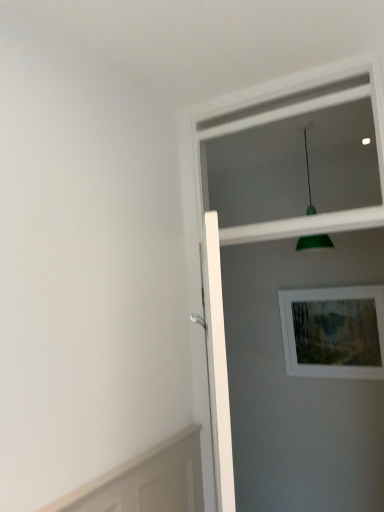
Identify the location of white glossy screen door at upper right. (291, 291).

In order to face white plastic window frame at upper center, should I rotate leftwards or rightwards?

To align with it, rotate right about 11.544°.

Image resolution: width=384 pixels, height=512 pixels. Describe the element at coordinates (314, 243) in the screenshot. I see `green matte pendant light at upper center` at that location.

Locate an element on the screen. wooden picture frame at upper right is located at coordinates (334, 332).

The height and width of the screenshot is (512, 384). Find the location of `white glossy screen door at upper right`. white glossy screen door at upper right is located at coordinates (291, 291).

Would you say white glossy screen door at upper right is inside or outside wooden picture frame at upper right?

white glossy screen door at upper right is located beyond the bounds of wooden picture frame at upper right.

From the image's perspective, would you say white glossy screen door at upper right is shown under wooden picture frame at upper right?

Yes, from the image's perspective, white glossy screen door at upper right is below wooden picture frame at upper right.

Which is closer, (x=289, y=92) or (x=334, y=298)?

Point (x=289, y=92) is closer to the camera than point (x=334, y=298).

The image size is (384, 512). What are the coordinates of `screen door located underneath the white plastic window frame at upper center (from a real-world perspective)` in the screenshot? It's located at (291, 291).

Can you confirm if white plastic window frame at upper center is thinner than white glossy screen door at upper right?

Correct, the width of white plastic window frame at upper center is less than that of white glossy screen door at upper right.

From the image's perspective, is white plastic window frame at upper center positioned above or below white glossy screen door at upper right?

Based on their image positions, white plastic window frame at upper center is located above white glossy screen door at upper right.

Based on their sizes in the image, would you say white plastic window frame at upper center is bigger or smaller than wooden picture frame at upper right?

Clearly, white plastic window frame at upper center is larger in size than wooden picture frame at upper right.

Would you say wooden picture frame at upper right is part of white plastic window frame at upper center's contents?

Definitely not — wooden picture frame at upper right is not inside white plastic window frame at upper center.

From the picture: Considering the positions of objects white plastic window frame at upper center and wooden picture frame at upper right in the image provided, who is more to the left, white plastic window frame at upper center or wooden picture frame at upper right?

Positioned to the left is white plastic window frame at upper center.

Considering the sizes of objects white plastic window frame at upper center and wooden picture frame at upper right in the image provided, who is thinner, white plastic window frame at upper center or wooden picture frame at upper right?

Thinner between the two is wooden picture frame at upper right.

Is green matte pendant light at upper center situated inside white glossy screen door at upper right or outside?

The correct answer is: outside.

Is green matte pendant light at upper center thinner than white glossy screen door at upper right?

In fact, green matte pendant light at upper center might be wider than white glossy screen door at upper right.

Looking at this image, which object is closer to the camera taking this photo, green matte pendant light at upper center or white glossy screen door at upper right?

white glossy screen door at upper right is more forward.

Considering the sizes of white plastic window frame at upper center and green matte pendant light at upper center in the image, is white plastic window frame at upper center bigger or smaller than green matte pendant light at upper center?

Considering their sizes, white plastic window frame at upper center takes up more space than green matte pendant light at upper center.

Is white plastic window frame at upper center in front of or behind green matte pendant light at upper center in the image?

white plastic window frame at upper center is in front of green matte pendant light at upper center.

How distant is white plastic window frame at upper center from green matte pendant light at upper center?

The distance of white plastic window frame at upper center from green matte pendant light at upper center is 11.32 inches.

From the image's perspective, does white plastic window frame at upper center appear higher than green matte pendant light at upper center?

Yes.

How different are the orientations of white glossy screen door at upper right and white plastic window frame at upper center in degrees?

They differ by 0.000608 degrees in their facing directions.

Based on the photo, would you say white glossy screen door at upper right is outside white plastic window frame at upper center?

Yes.

Considering the sizes of objects white glossy screen door at upper right and white plastic window frame at upper center in the image provided, who is smaller, white glossy screen door at upper right or white plastic window frame at upper center?

white plastic window frame at upper center.

How much distance is there between green matte pendant light at upper center and wooden picture frame at upper right?

green matte pendant light at upper center and wooden picture frame at upper right are 20.75 inches apart.

Considering the positions of objects green matte pendant light at upper center and wooden picture frame at upper right in the image provided, who is more to the left, green matte pendant light at upper center or wooden picture frame at upper right?

green matte pendant light at upper center is more to the left.

The height and width of the screenshot is (512, 384). In order to click on picture frame that appears on the right of green matte pendant light at upper center in this screenshot , I will do `click(334, 332)`.

Based on the photo, can you tell me how much green matte pendant light at upper center and wooden picture frame at upper right differ in facing direction?

The angle between the facing direction of green matte pendant light at upper center and the facing direction of wooden picture frame at upper right is 1.24 degrees.

Image resolution: width=384 pixels, height=512 pixels. Identify the location of picture frame on the right of white glossy screen door at upper right. (334, 332).

The height and width of the screenshot is (512, 384). Find the location of `screen door lying in front of the white plastic window frame at upper center`. screen door lying in front of the white plastic window frame at upper center is located at coordinates (291, 291).

Looking at the image, which one is located further to wooden picture frame at upper right, white glossy screen door at upper right or white plastic window frame at upper center?

white plastic window frame at upper center is positioned further to the anchor wooden picture frame at upper right.

Based on their spatial positions, is white glossy screen door at upper right or wooden picture frame at upper right closer to green matte pendant light at upper center?

wooden picture frame at upper right.

Consider the image. Which object lies further to the anchor point white glossy screen door at upper right, wooden picture frame at upper right or white plastic window frame at upper center?

white plastic window frame at upper center lies further to white glossy screen door at upper right than the other object.

Which object lies nearer to the anchor point green matte pendant light at upper center, wooden picture frame at upper right or white glossy screen door at upper right?

Among the two, wooden picture frame at upper right is located nearer to green matte pendant light at upper center.

Estimate the real-world distances between objects in this image. Which object is closer to white glossy screen door at upper right, green matte pendant light at upper center or white plastic window frame at upper center?

Based on the image, white plastic window frame at upper center appears to be nearer to white glossy screen door at upper right.

Considering their positions, is wooden picture frame at upper right positioned closer to white plastic window frame at upper center than white glossy screen door at upper right?

white glossy screen door at upper right.

Based on their spatial positions, is white glossy screen door at upper right or wooden picture frame at upper right further from white plastic window frame at upper center?

Based on the image, wooden picture frame at upper right appears to be further to white plastic window frame at upper center.

From the image, which object appears to be nearer to white glossy screen door at upper right, wooden picture frame at upper right or green matte pendant light at upper center?

wooden picture frame at upper right is positioned closer to the anchor white glossy screen door at upper right.

You are a GUI agent. You are given a task and a screenshot of the screen. Output one action in this format:
    pyautogui.click(x=<x>, y=<y>)
    Task: Click on the light fixture that lies between white plastic window frame at upper center and wooden picture frame at upper right from top to bottom
    The height and width of the screenshot is (512, 384).
    Given the screenshot: What is the action you would take?
    pyautogui.click(x=314, y=243)

Identify the location of window frame between white glossy screen door at upper right and wooden picture frame at upper right in the front-back direction. (295, 157).

Where is `light fixture between white glossy screen door at upper right and wooden picture frame at upper right in the front-back direction`? The width and height of the screenshot is (384, 512). light fixture between white glossy screen door at upper right and wooden picture frame at upper right in the front-back direction is located at coordinates (314, 243).

At what (x,y) coordinates should I click in order to perform the action: click on light fixture that lies between white plastic window frame at upper center and white glossy screen door at upper right from top to bottom. Please return your answer as a coordinate pair (x, y). Image resolution: width=384 pixels, height=512 pixels. Looking at the image, I should click on (314, 243).